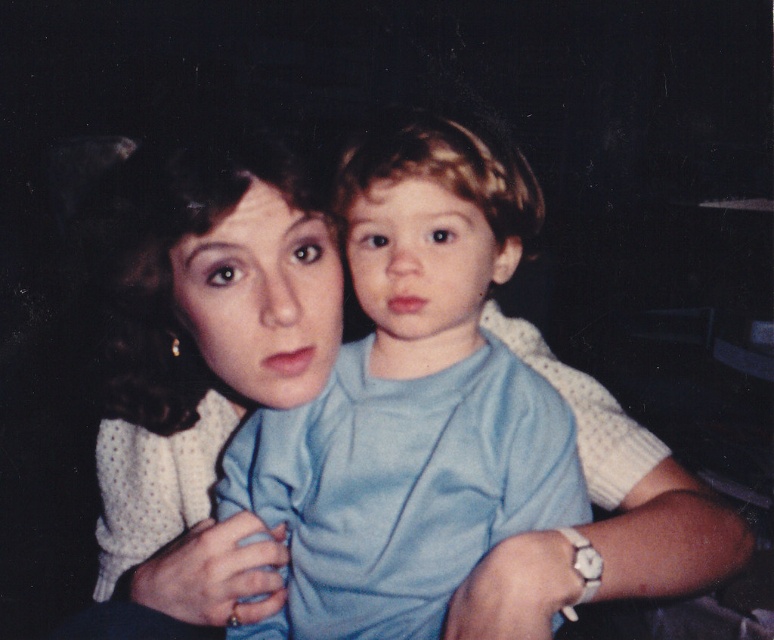
In the scene shown: Is light blue cotton shirt at center below white dotted sweater at upper left?

Incorrect, light blue cotton shirt at center is not positioned below white dotted sweater at upper left.

Does light blue cotton shirt at center have a smaller size compared to white dotted sweater at upper left?

Correct, light blue cotton shirt at center occupies less space than white dotted sweater at upper left.

Between point (372, 198) and point (110, 582), which one is positioned behind?

Positioned behind is point (110, 582).

Identify the location of light blue cotton shirt at center. The image size is (774, 640). (413, 401).